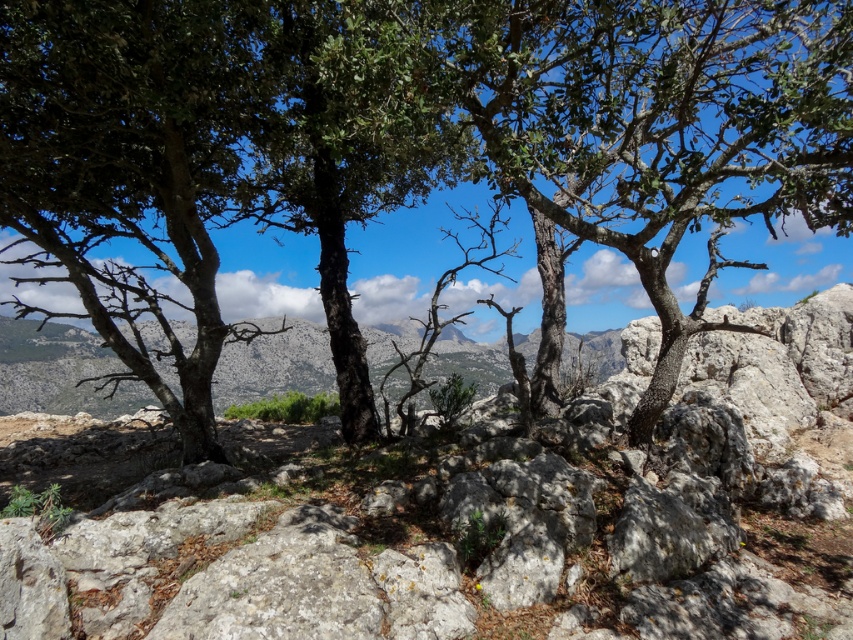
You are a hiker standing at the edge of this rocky landscape. You notice a green leafy tree at center and a gray rough rock at center. Which object would block your view more if you were to stand directly behind it?

The green leafy tree at center is taller than the gray rough rock at center, so it would block your view more if you were to stand directly behind it.

You are a hiker trying to navigate through this rocky landscape. You see a green leafy tree at center and a gray rough rock at center. Which object is higher up in the scene?

The green leafy tree at center is located above the gray rough rock at center, so it is higher up in the scene.